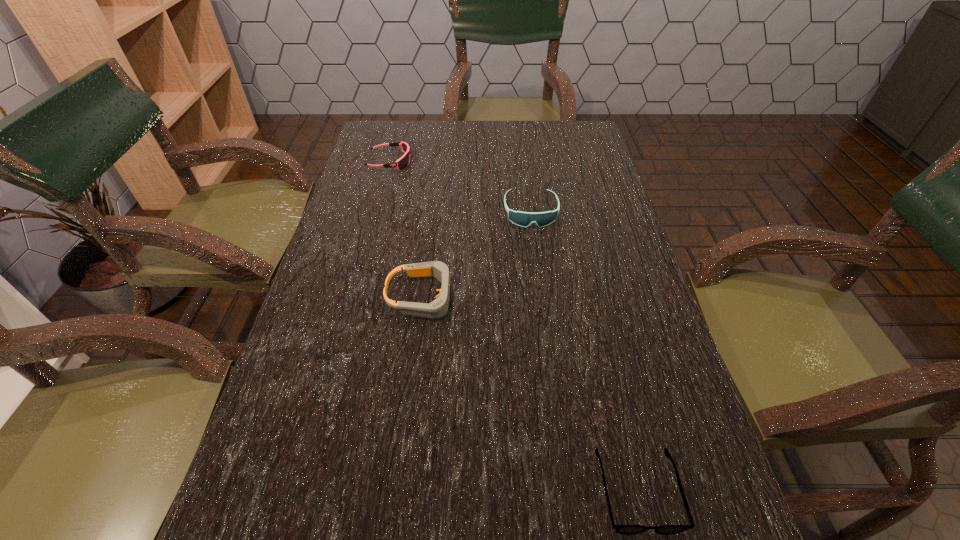
Image resolution: width=960 pixels, height=540 pixels. Identify the location of free space between the third farthest object and the spectacles. (530, 394).

Find the location of a particular element. free spot between the rightmost goggles and the leftmost object is located at coordinates (460, 187).

The image size is (960, 540). Find the location of `vacant area that lies between the leftmost goggles and the second farthest goggles`. vacant area that lies between the leftmost goggles and the second farthest goggles is located at coordinates (460, 187).

Where is `vacant area that lies between the second goggles from right to left and the farthest object`? vacant area that lies between the second goggles from right to left and the farthest object is located at coordinates (406, 230).

Image resolution: width=960 pixels, height=540 pixels. Identify the location of free point between the second farthest object and the nearest object. (584, 352).

Find the location of a particular element. vacant point located between the farthest object and the third farthest object is located at coordinates (406, 230).

This screenshot has height=540, width=960. What are the coordinates of `blank region between the farthest goggles and the spectacles` in the screenshot? It's located at (514, 327).

Find the location of a particular element. This screenshot has height=540, width=960. vacant region between the second object from left to right and the spectacles is located at coordinates (530, 394).

At what (x,y) coordinates should I click in order to perform the action: click on free point between the rightmost goggles and the farthest object. Please return your answer as a coordinate pair (x, y). Image resolution: width=960 pixels, height=540 pixels. Looking at the image, I should click on (460, 187).

You are a GUI agent. You are given a task and a screenshot of the screen. Output one action in this format:
    pyautogui.click(x=<x>, y=<y>)
    Task: Click on the object that can be found as the closest to the leftmost goggles
    
    Given the screenshot: What is the action you would take?
    pyautogui.click(x=524, y=219)